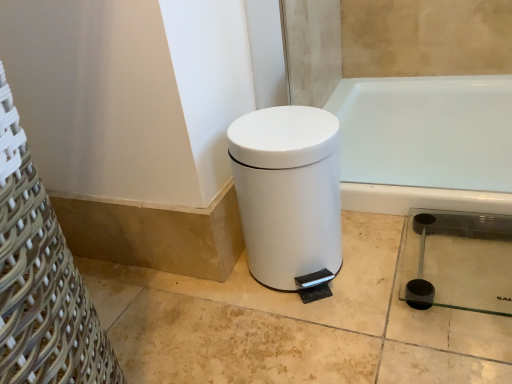
I want to click on empty space that is ontop of white matte waste container at lower center, so click(274, 129).